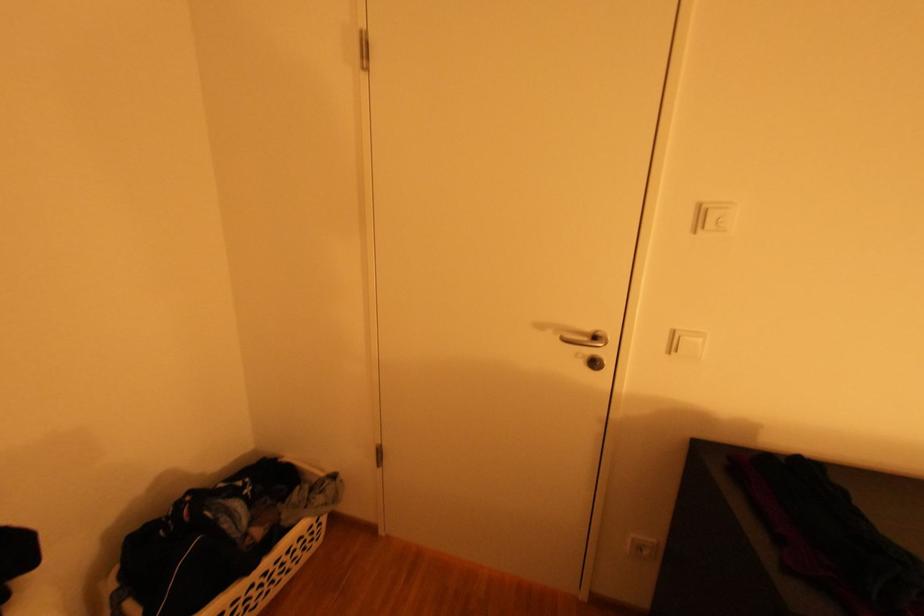
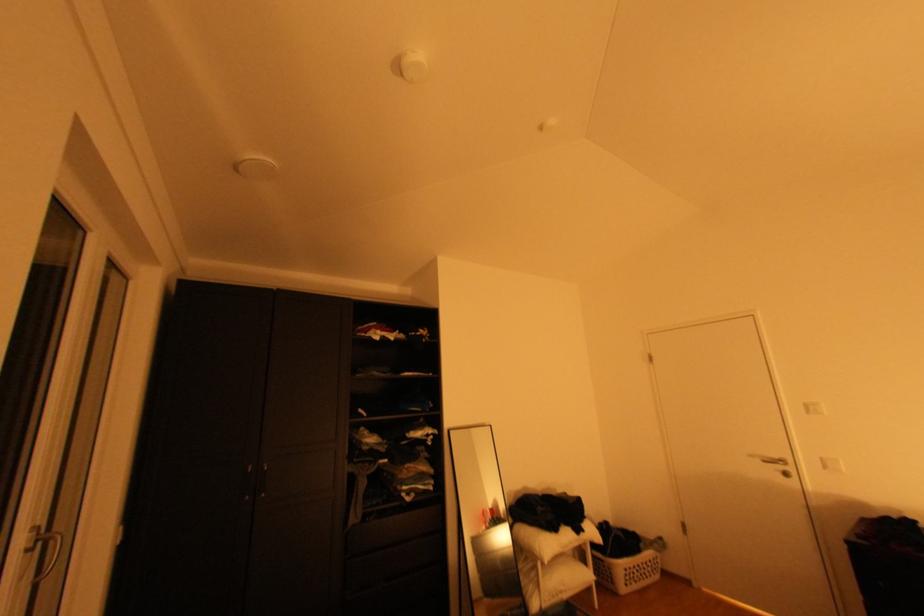
Where in the second image is the point corresponding to the point at 599,330 from the first image?

(786, 456)